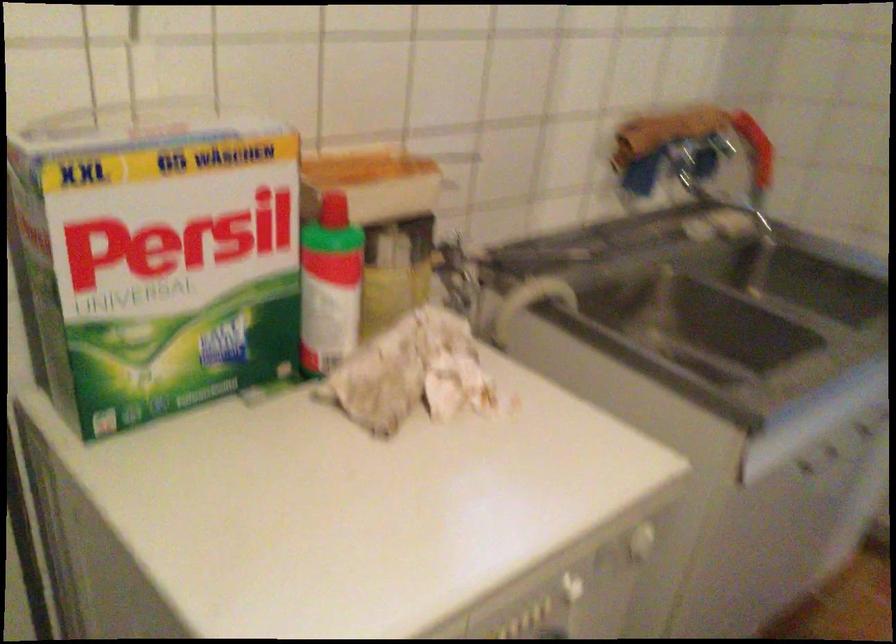
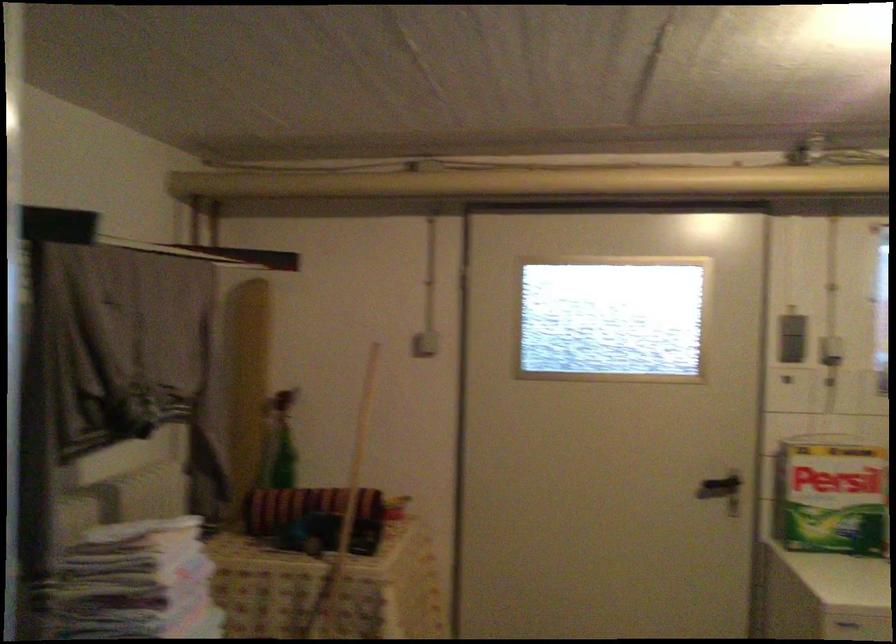
Where in the second image is the point corresponding to (x=175, y=283) from the first image?

(831, 496)